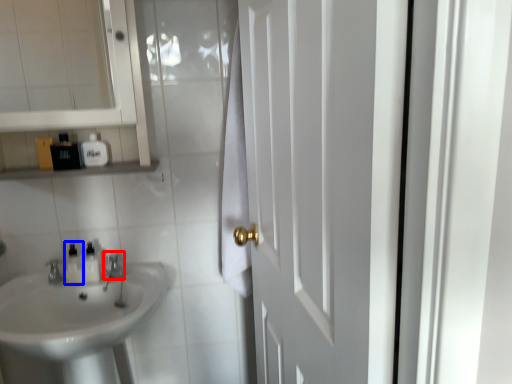
Question: Which object is further to the camera taking this photo, faucet (highlighted by a red box) or toiletry (highlighted by a blue box)?

Choices:
 (A) faucet
 (B) toiletry

Answer: (B)